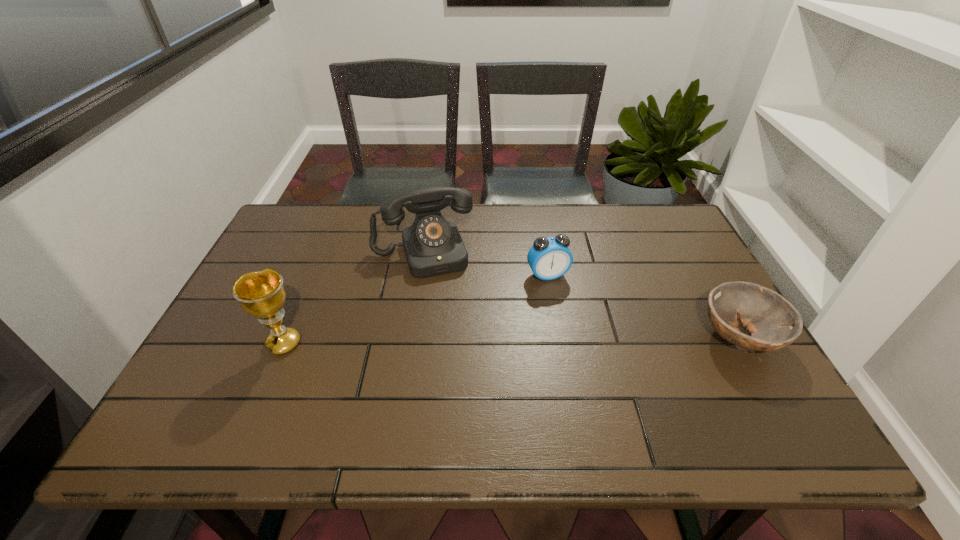
The width and height of the screenshot is (960, 540). In order to click on free region at the near edge in this screenshot , I will do `click(656, 381)`.

The width and height of the screenshot is (960, 540). I want to click on free space at the left edge, so click(292, 274).

The height and width of the screenshot is (540, 960). In order to click on vacant area at the right edge of the desktop in this screenshot , I will do `click(695, 251)`.

Find the location of a particular element. This screenshot has height=540, width=960. free space at the far left corner of the desktop is located at coordinates (291, 226).

Identify the location of free space at the near left corner of the desktop. (185, 404).

Locate an element on the screen. The width and height of the screenshot is (960, 540). vacant space at the far right corner of the desktop is located at coordinates (x=664, y=226).

You are a GUI agent. You are given a task and a screenshot of the screen. Output one action in this format:
    pyautogui.click(x=<x>, y=<y>)
    Task: Click on the vacant space that's between the telephone and the alarm clock
    The height and width of the screenshot is (540, 960).
    Given the screenshot: What is the action you would take?
    pyautogui.click(x=485, y=264)

The width and height of the screenshot is (960, 540). In order to click on vacant region between the third object from left to right and the chalice in this screenshot , I will do `click(416, 309)`.

Identify the location of empty space between the leftmost object and the alarm clock. (416, 309).

At what (x,y) coordinates should I click in order to perform the action: click on free space between the third object from right to left and the bowl. Please return your answer as a coordinate pair (x, y). The width and height of the screenshot is (960, 540). Looking at the image, I should click on (581, 295).